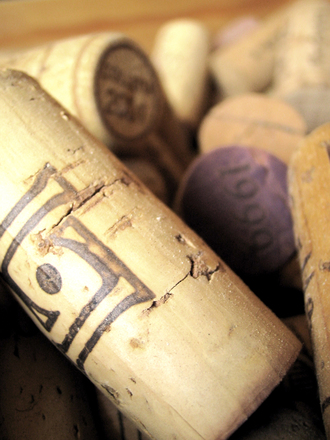
Where is `brown wall`? The width and height of the screenshot is (330, 440). brown wall is located at coordinates (135, 20).